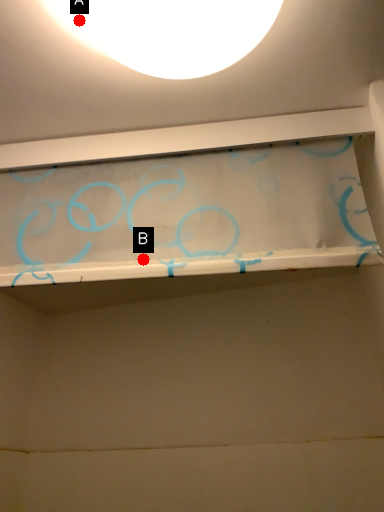
Question: Two points are circled on the image, labeled by A and B beside each circle. Which point is further to the camera?

Choices:
 (A) A is further
 (B) B is further

Answer: (B)